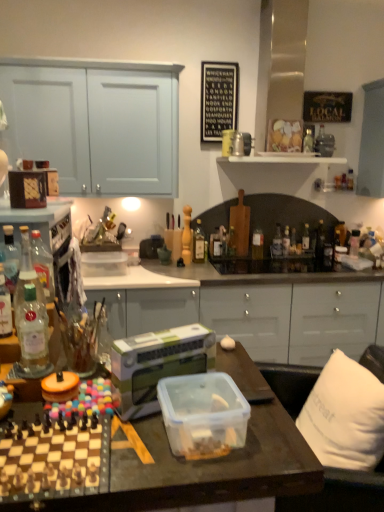
Question: Is clear glass bottle at right, the 13th bottle positioned from the front, inside the boundaries of translucent glass bottle at center, arranged as the 9th bottle when viewed from the front, or outside?

Choices:
 (A) outside
 (B) inside

Answer: (A)

Question: Considering the positions of clear glass bottle at right, which ranks as the second bottle in right-to-left order, and translucent glass bottle at center, which ranks as the 6th bottle in right-to-left order, in the image, is clear glass bottle at right, which ranks as the second bottle in right-to-left order, bigger or smaller than translucent glass bottle at center, which ranks as the 6th bottle in right-to-left order,?

Choices:
 (A) big
 (B) small

Answer: (B)

Question: Considering the real-world distances, which object is closest to the black paperboard at upper center?

Choices:
 (A) translucent glass bottle at center, acting as the eighth bottle starting from the right
 (B) clear glass bottle at upper center, marked as the tenth bottle in a left-to-right arrangement
 (C) clear glass bottle at left, marked as the 1th bottle in a front-to-back arrangement
 (D) clear glass bottle at left, which is the 12th bottle in right-to-left order
 (E) translucent glass bottle at center, which is the tenth bottle in right-to-left order

Answer: (B)

Question: Which is nearer to the translucent glass bottle at center, placed as the 6th bottle when sorted from front to back?

Choices:
 (A) white plastic shelf at upper center
 (B) translucent glass bottle at center, which appears as the fourth bottle when viewed from the left
 (C) clear glass bottle at upper center, which ranks as the 4th bottle in front-to-back order
 (D) clear glass bottle at right, placed as the 12th bottle when sorted from left to right
 (E) white fabric pillow at right

Answer: (B)